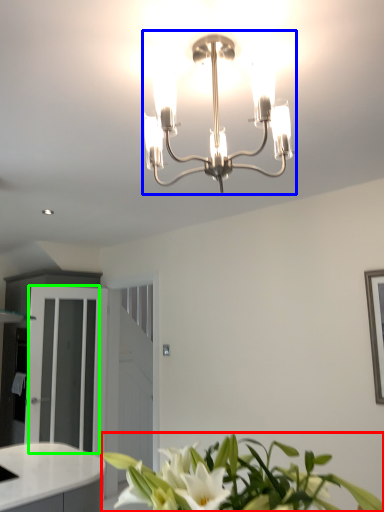
Question: Which is nearer to the houseplant (highlighted by a red box)? lamp (highlighted by a blue box) or glass door (highlighted by a green box).

Choices:
 (A) lamp
 (B) glass door

Answer: (A)